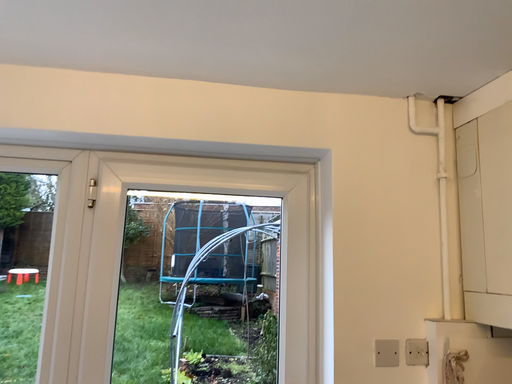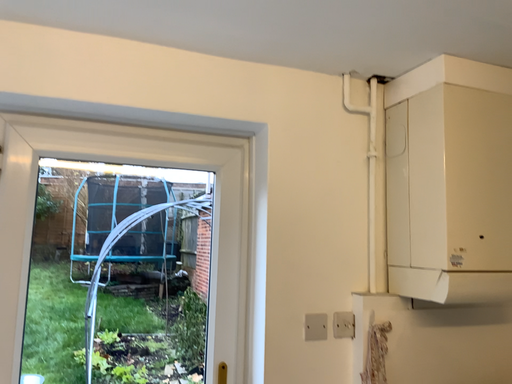
Question: Which way did the camera rotate in the video?

Choices:
 (A) rotated right
 (B) rotated left

Answer: (A)